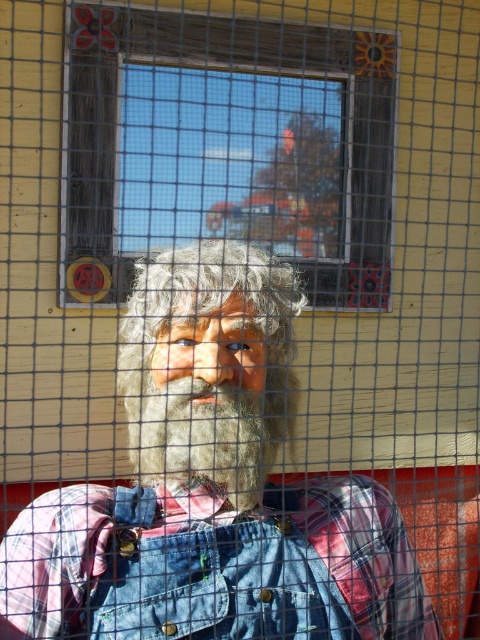
Question: Does clear glass window at center have a lesser width compared to fuzzy brown beard at center?

Choices:
 (A) yes
 (B) no

Answer: (B)

Question: Among these points, which one is nearest to the camera?

Choices:
 (A) (322, 225)
 (B) (205, 448)

Answer: (B)

Question: Which point is closer to the camera?

Choices:
 (A) fuzzy brown beard at center
 (B) clear glass window at center

Answer: (A)

Question: Can you confirm if clear glass window at center is thinner than fuzzy brown beard at center?

Choices:
 (A) yes
 (B) no

Answer: (B)

Question: Can you confirm if clear glass window at center is positioned to the left of fuzzy brown beard at center?

Choices:
 (A) yes
 (B) no

Answer: (B)